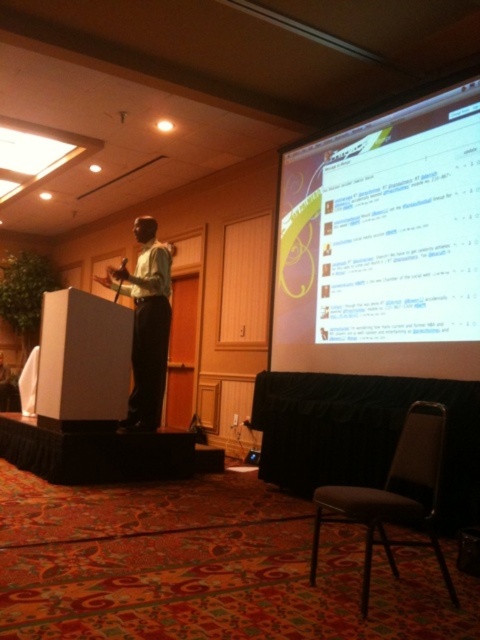
Question: Does white glossy projection screen at upper right appear over matte green shirt at center?

Choices:
 (A) yes
 (B) no

Answer: (A)

Question: Based on their relative distances, which object is farther from the gray fabric chair at lower right?

Choices:
 (A) white glossy projection screen at upper right
 (B) matte green shirt at center

Answer: (B)

Question: Can you confirm if gray fabric chair at lower right is wider than matte green shirt at center?

Choices:
 (A) no
 (B) yes

Answer: (B)

Question: Which point is closer to the camera taking this photo?

Choices:
 (A) (475, 113)
 (B) (170, 264)

Answer: (A)

Question: Can you confirm if gray fabric chair at lower right is smaller than matte green shirt at center?

Choices:
 (A) no
 (B) yes

Answer: (A)

Question: Considering the real-world distances, which object is farthest from the matte green shirt at center?

Choices:
 (A) white glossy projection screen at upper right
 (B) gray fabric chair at lower right

Answer: (B)